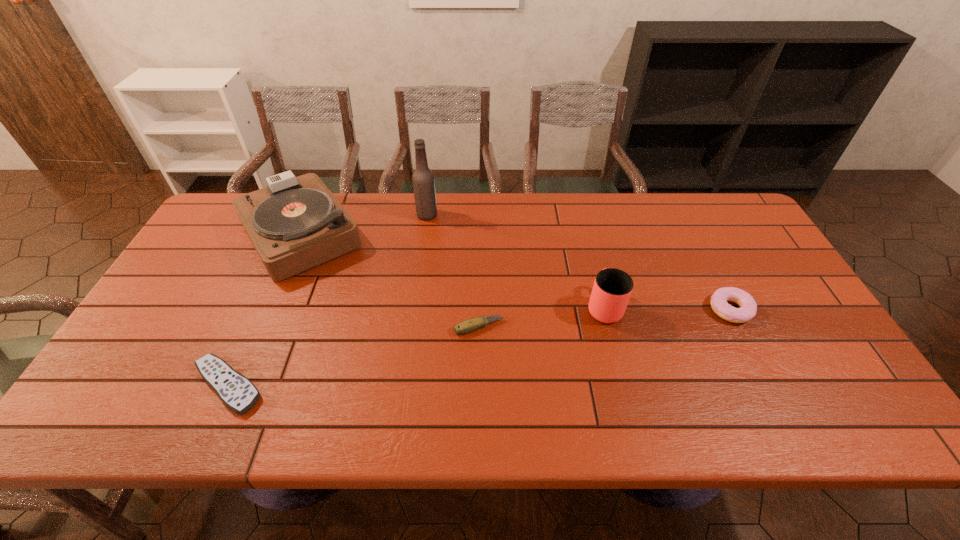
Find the location of a particular element. Image resolution: width=960 pixels, height=540 pixels. vacant space that satisfies the following two spatial constraints: 1. on the side of the third object from left to right with the label; 2. on the handle side of the fifth object from left to right is located at coordinates (415, 306).

At what (x,y) coordinates should I click in order to perform the action: click on free space that satisfies the following two spatial constraints: 1. on the side of the pocketknife with the label; 2. on the left side of the tallest object. Please return your answer as a coordinate pair (x, y). This screenshot has width=960, height=540. Looking at the image, I should click on (412, 327).

The image size is (960, 540). In order to click on free spot that satisfies the following two spatial constraints: 1. on the side of the fourth object from left to right with the label; 2. on the left side of the beer bottle in this screenshot , I will do `click(412, 327)`.

You are a GUI agent. You are given a task and a screenshot of the screen. Output one action in this format:
    pyautogui.click(x=<x>, y=<y>)
    Task: Click on the free location that satisfies the following two spatial constraints: 1. on the side of the beer bottle with the label; 2. on the left side of the rightmost object
    
    Given the screenshot: What is the action you would take?
    pyautogui.click(x=415, y=310)

This screenshot has height=540, width=960. Identify the location of blank space that satisfies the following two spatial constraints: 1. on the side of the third object from right to left with the label; 2. on the right side of the fourth object from right to left. (412, 327).

Find the location of a particular element. The width and height of the screenshot is (960, 540). free space that satisfies the following two spatial constraints: 1. on the side of the doughnut with the label; 2. on the left side of the third object from left to right is located at coordinates [415, 310].

Where is `vacant space that satisfies the following two spatial constraints: 1. on the handle side of the fifth object from left to right; 2. on the side of the tallest object with the label`? This screenshot has height=540, width=960. vacant space that satisfies the following two spatial constraints: 1. on the handle side of the fifth object from left to right; 2. on the side of the tallest object with the label is located at coordinates (581, 215).